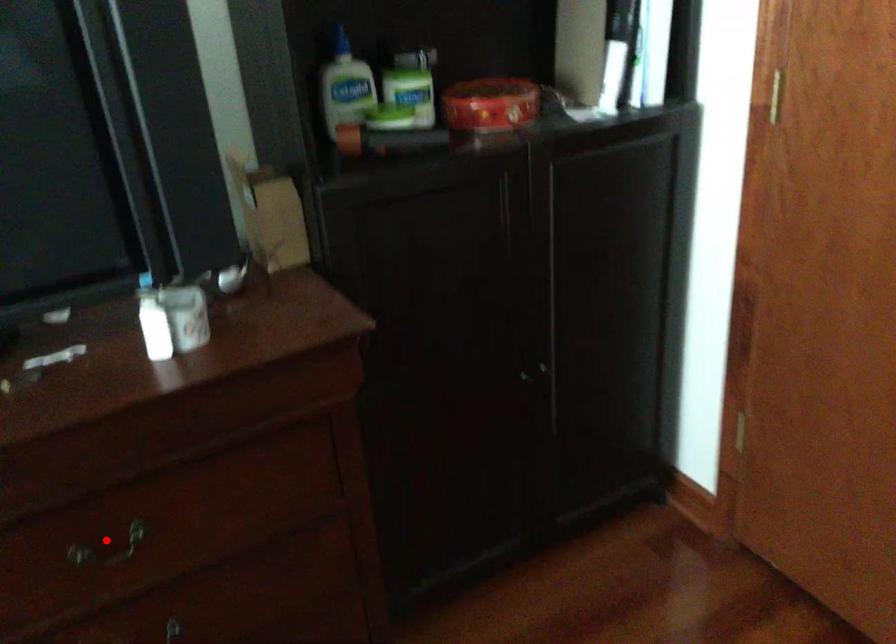
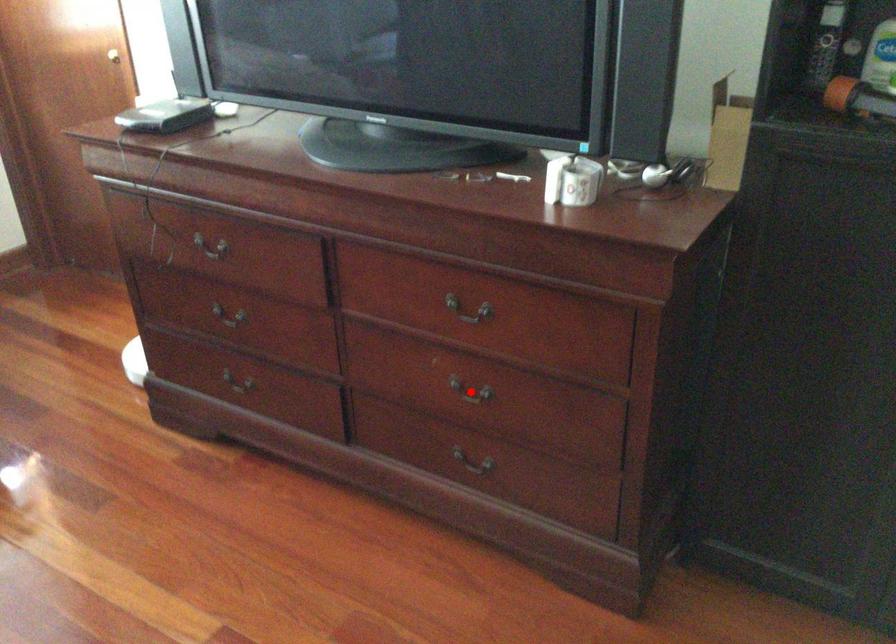
I am providing you with two images of the same scene from different viewpoints. A red point is marked on the first image and another point is marked on the second image. Is the marked point in image1 the same physical position as the marked point in image2?

No